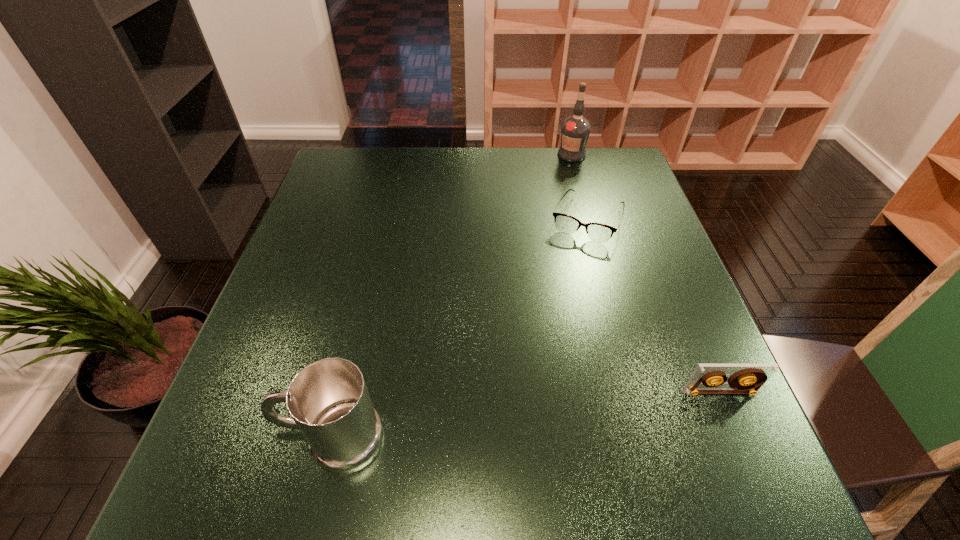
In order to click on free space between the leftmost object and the third nearest object in this screenshot , I will do `click(460, 329)`.

Locate an element on the screen. the closest object to the second tallest object is located at coordinates (746, 378).

Find the location of a particular element. the closest object to the spectacles is located at coordinates (575, 130).

Find the location of `vacant space that satisfies the following two spatial constraints: 1. on the back side of the farthest object; 2. on the right side of the shortest object`. vacant space that satisfies the following two spatial constraints: 1. on the back side of the farthest object; 2. on the right side of the shortest object is located at coordinates (569, 155).

Locate an element on the screen. This screenshot has height=540, width=960. vacant space that satisfies the following two spatial constraints: 1. on the back side of the shortest object; 2. on the right side of the tallest object is located at coordinates (569, 155).